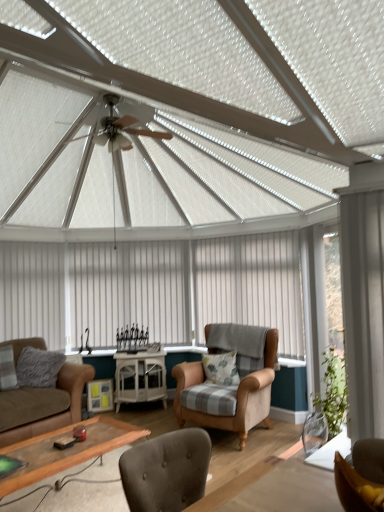
Identify the location of empty space that is ontop of white textured curtain at center, the first curtain viewed from the back (from a real-world perspective). Image resolution: width=384 pixels, height=512 pixels. (146, 236).